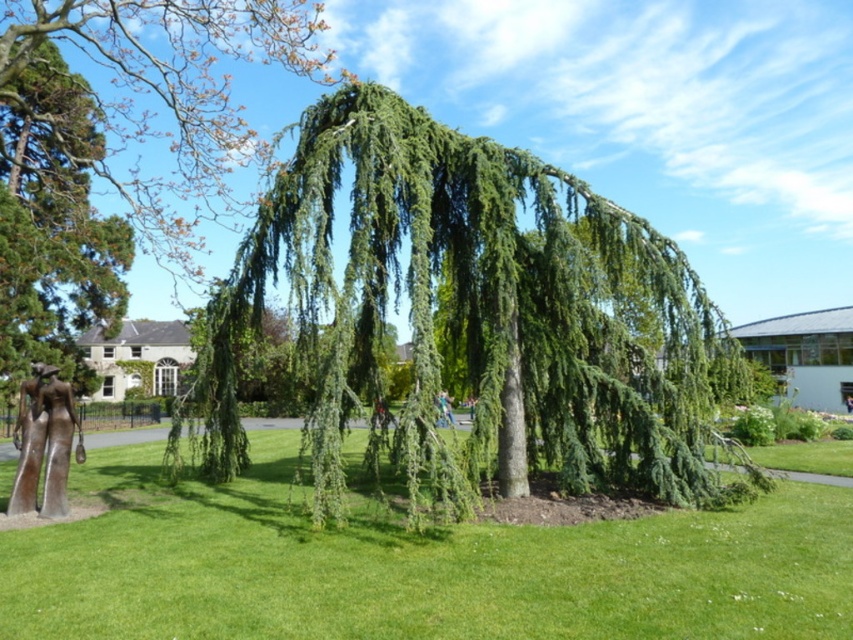
Which of these two, green needle-like leaves at center or green needle-like foliage at center, stands shorter?

With less height is green needle-like leaves at center.

In the scene shown: Between green needle-like leaves at center and green needle-like foliage at center, which one appears on the right side from the viewer's perspective?

From the viewer's perspective, green needle-like leaves at center appears more on the right side.

Find the location of a particular element. The image size is (853, 640). green needle-like leaves at center is located at coordinates (466, 317).

Does green needle-like foliage at center have a smaller size compared to bronze statue at lower left?

No.

I want to click on green needle-like foliage at center, so click(x=140, y=102).

What are the coordinates of `green needle-like foliage at center` in the screenshot? It's located at (140, 102).

Who is positioned more to the left, green grass at lower left or green needle-like foliage at center?

From the viewer's perspective, green needle-like foliage at center appears more on the left side.

Which is in front, point (457, 529) or point (94, 257)?

Positioned in front is point (457, 529).

Identify the location of green grass at lower left. The height and width of the screenshot is (640, 853). (415, 566).